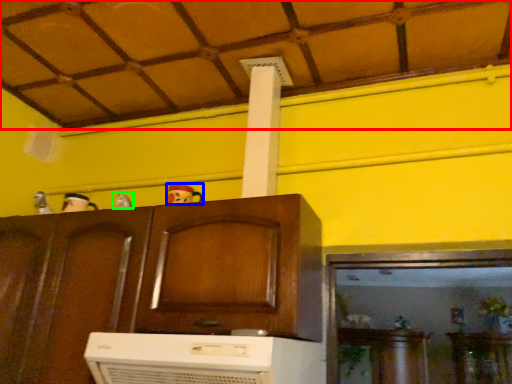
Question: Which object is the closest to the tile roof (highlighted by a red box)? Choose among these: toy (highlighted by a blue box) or toy (highlighted by a green box).

Choices:
 (A) toy
 (B) toy

Answer: (A)